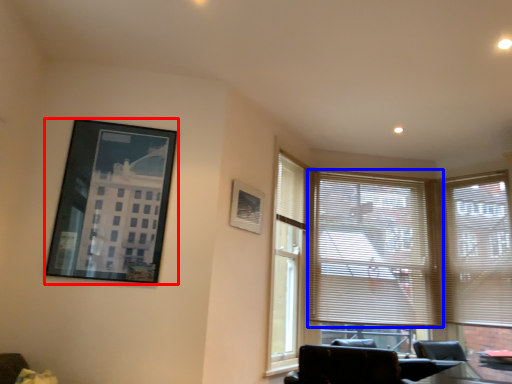
Question: Which object is further to the camera taking this photo, picture frame (highlighted by a red box) or window blind (highlighted by a blue box)?

Choices:
 (A) picture frame
 (B) window blind

Answer: (B)